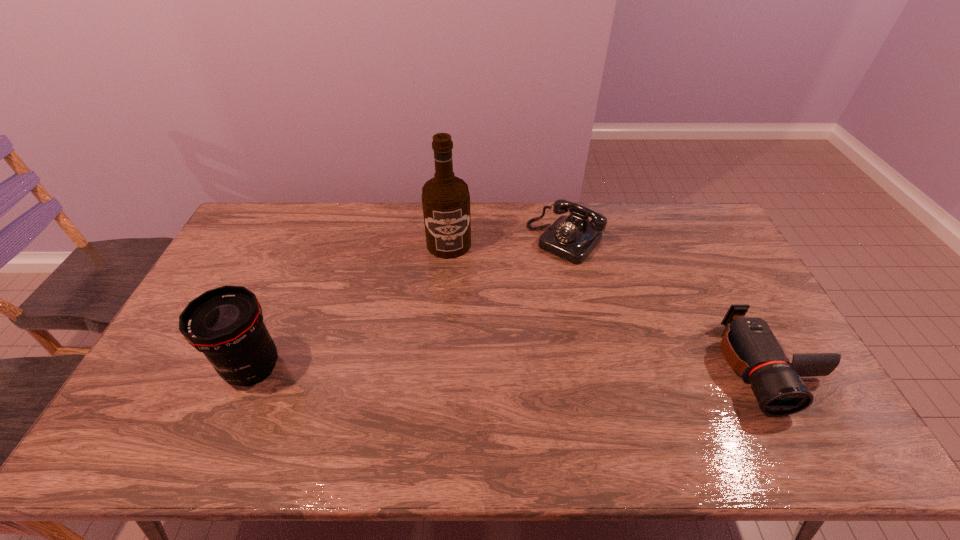
What are the coordinates of `free space at the far edge of the desktop` in the screenshot? It's located at (404, 220).

Where is `free region at the near edge`? The width and height of the screenshot is (960, 540). free region at the near edge is located at coordinates (359, 411).

You are a GUI agent. You are given a task and a screenshot of the screen. Output one action in this format:
    pyautogui.click(x=<x>, y=<y>)
    Task: Click on the vacant area at the left edge
    Image resolution: width=960 pixels, height=540 pixels.
    Given the screenshot: What is the action you would take?
    click(x=177, y=369)

The width and height of the screenshot is (960, 540). Find the location of `free space at the right edge of the desktop`. free space at the right edge of the desktop is located at coordinates (740, 281).

Find the location of `vacant space at the far left corner`. vacant space at the far left corner is located at coordinates (248, 242).

Identify the location of vacant space at the near left corner of the desktop. (199, 400).

Where is `free space at the far right corner`? This screenshot has height=540, width=960. free space at the far right corner is located at coordinates (698, 202).

Where is `unoccupied position between the camcorder and the telephoto lens`? The image size is (960, 540). unoccupied position between the camcorder and the telephoto lens is located at coordinates (510, 367).

This screenshot has width=960, height=540. Find the location of `free space between the second tallest object and the second object from right to left`. free space between the second tallest object and the second object from right to left is located at coordinates (409, 304).

Find the location of `free space that is in between the leftmost object and the second object from right to left`. free space that is in between the leftmost object and the second object from right to left is located at coordinates (409, 304).